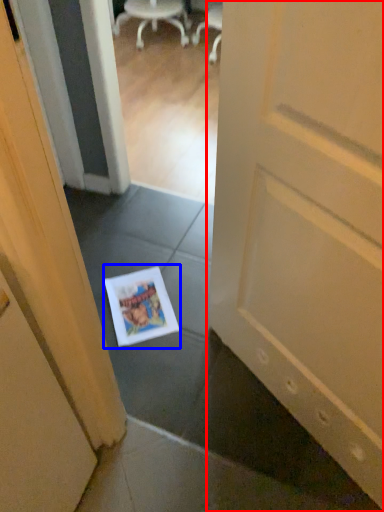
Question: Among these objects, which one is farthest to the camera, door (highlighted by a red box) or magazine (highlighted by a blue box)?

Choices:
 (A) door
 (B) magazine

Answer: (B)